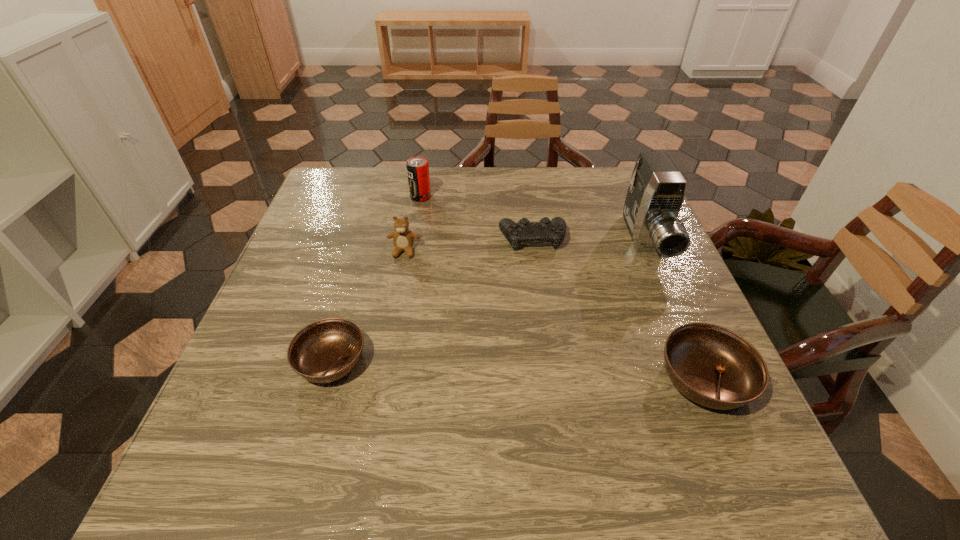
Locate an element on the screen. This screenshot has height=540, width=960. free space between the teddy bear and the shortest object is located at coordinates (368, 306).

What are the coordinates of `vacant space that's between the camcorder and the left soup bowl` in the screenshot? It's located at tap(489, 301).

Locate an element on the screen. free space between the shorter soup bowl and the third object from right to left is located at coordinates point(432,300).

The height and width of the screenshot is (540, 960). I want to click on free space between the taller soup bowl and the control, so click(x=618, y=308).

This screenshot has height=540, width=960. In order to click on the fifth closest object to the shorter soup bowl in this screenshot , I will do `click(656, 191)`.

You are a GUI agent. You are given a task and a screenshot of the screen. Output one action in this format:
    pyautogui.click(x=<x>, y=<y>)
    Task: Click on the object that can be found as the closest to the teddy bear
    This screenshot has height=540, width=960.
    Given the screenshot: What is the action you would take?
    [417, 167]

Where is `vacant point that satisfies the following two spatial constraints: 1. on the front side of the right soup bowl; 2. on the left side of the second tallest object`? vacant point that satisfies the following two spatial constraints: 1. on the front side of the right soup bowl; 2. on the left side of the second tallest object is located at coordinates (390, 379).

Locate an element on the screen. vacant area that satisfies the following two spatial constraints: 1. on the front-facing side of the right soup bowl; 2. on the right side of the fourth shortest object is located at coordinates (380, 379).